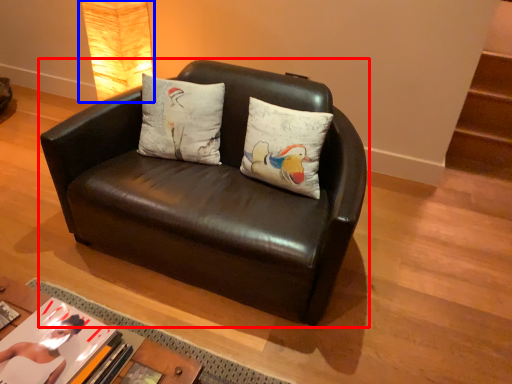
Question: Among these objects, which one is farthest to the camera, studio couch (highlighted by a red box) or lamp (highlighted by a blue box)?

Choices:
 (A) studio couch
 (B) lamp

Answer: (B)